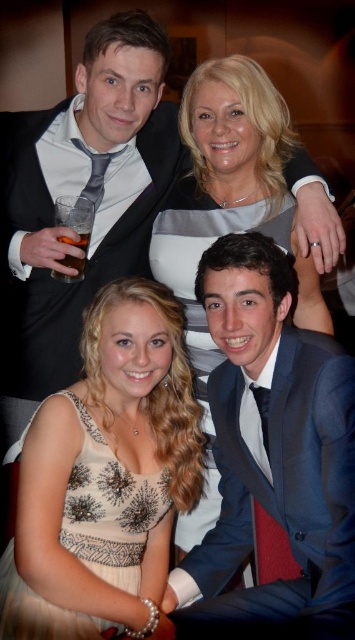
You are a photographer setting up for a group photo. You have a blue satin suit at upper center and a translucent glass at upper left in your frame. Which object takes up more horizontal space in the image?

The blue satin suit at upper center takes up more horizontal space than the translucent glass at upper left because its width is larger.

You are a photographer at the event and need to adjust the lighting to ensure both the blue satin suit at upper center and the beige sequined dress at lower left are well lit. Considering their positions, which one is closer to the background and might need additional back lighting?

The beige sequined dress at lower left is behind the blue satin suit at upper center, so it is closer to the background and may require additional back lighting to ensure proper illumination.